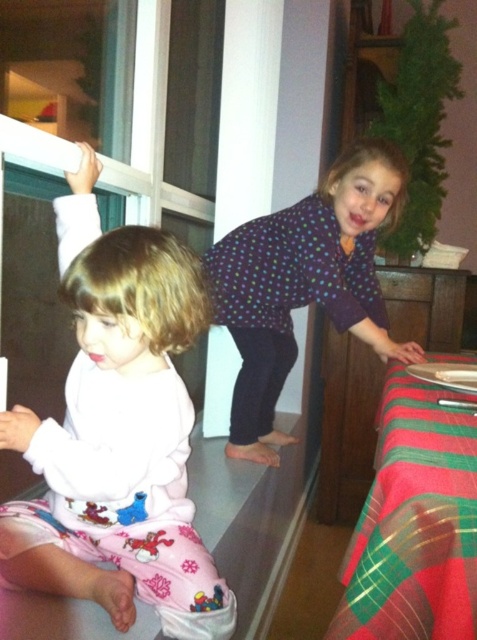
Question: Does white soft pajamas at left have a greater width compared to polka dot shirt at upper right?

Choices:
 (A) no
 (B) yes

Answer: (A)

Question: Which object is positioned closest to the red plaid tablecloth at lower right?

Choices:
 (A) polka dot shirt at upper right
 (B) white soft pajamas at left
 (C) white plastic screen door at left

Answer: (B)

Question: Which object is positioned farthest from the red plaid tablecloth at lower right?

Choices:
 (A) white plastic screen door at left
 (B) polka dot shirt at upper right
 (C) white soft pajamas at left

Answer: (A)

Question: Which point is closer to the camera?

Choices:
 (A) (26, 403)
 (B) (355, 244)
 (C) (454, 531)

Answer: (C)

Question: Observing the image, what is the correct spatial positioning of white soft pajamas at left in reference to red plaid tablecloth at lower right?

Choices:
 (A) below
 (B) above

Answer: (B)

Question: Does white soft pajamas at left lie behind red plaid tablecloth at lower right?

Choices:
 (A) no
 (B) yes

Answer: (B)